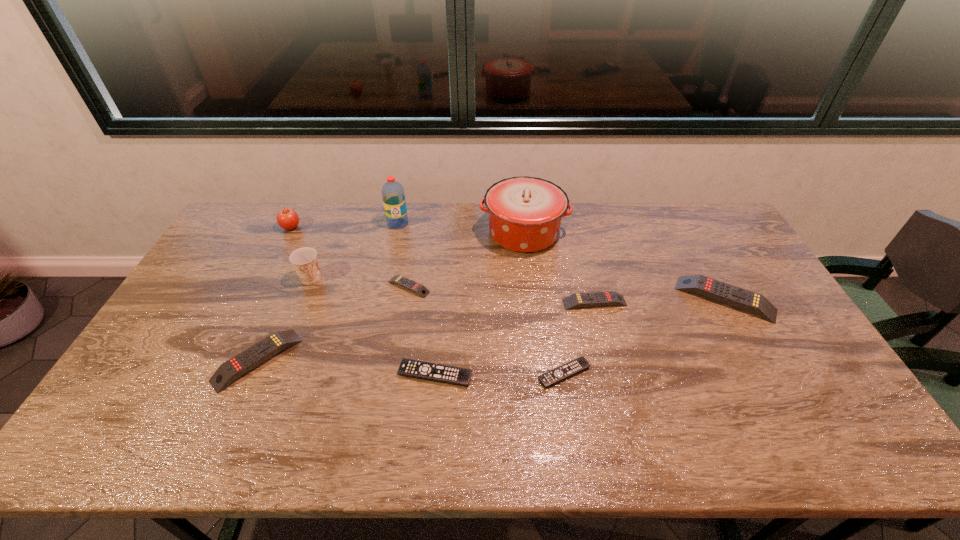
Identify the location of vacant region that satisfies the following two spatial constraints: 1. on the front side of the third yellow remote control from right to left; 2. on the left side of the shortest remote control. The width and height of the screenshot is (960, 540). (395, 374).

The height and width of the screenshot is (540, 960). Identify the location of vacant region that satisfies the following two spatial constraints: 1. on the front side of the casserole; 2. on the left side of the rightmost remote control. (531, 299).

This screenshot has height=540, width=960. What are the coordinates of `vacant space that satisfies the following two spatial constraints: 1. on the front label of the rightmost object; 2. on the left side of the water bottle` in the screenshot? It's located at (381, 299).